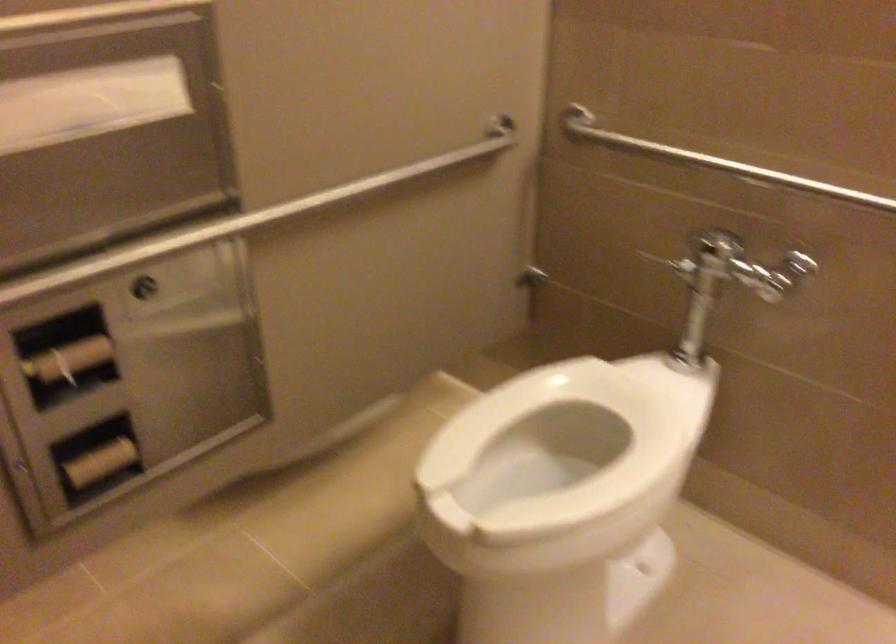
You are a GUI agent. You are given a task and a screenshot of the screen. Output one action in this format:
    pyautogui.click(x=<x>, y=<y>)
    Task: Click on the metal flush handle
    This screenshot has height=644, width=896.
    Given the screenshot: What is the action you would take?
    pyautogui.click(x=703, y=260)